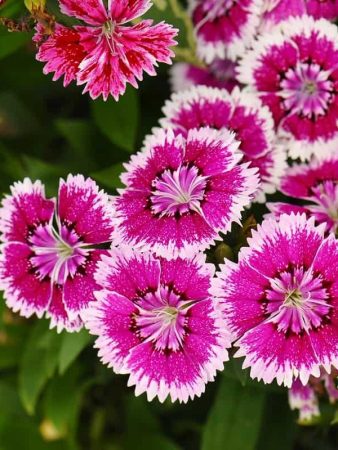
Where is `left flower`? The height and width of the screenshot is (450, 338). left flower is located at coordinates (68, 295).